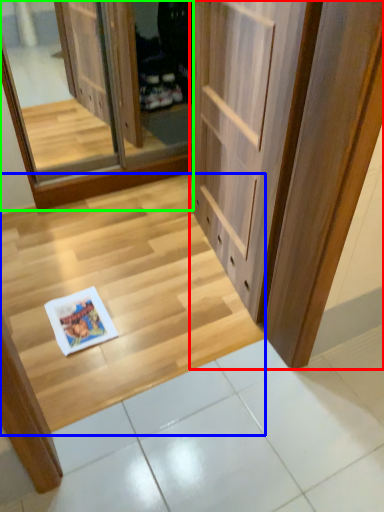
Question: Estimate the real-world distances between objects in this image. Which object is farther from door (highlighted by a red box), stairwell (highlighted by a blue box) or screen door (highlighted by a green box)?

Choices:
 (A) stairwell
 (B) screen door

Answer: (B)